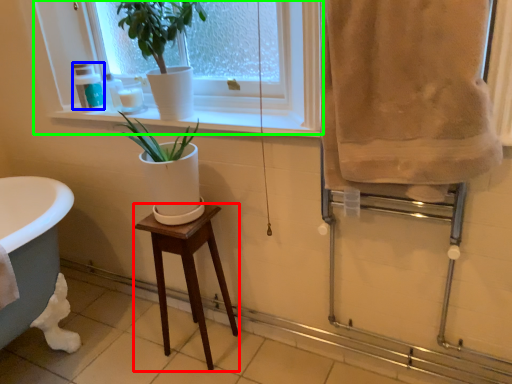
Question: Estimate the real-world distances between objects in this image. Which object is farther from stool (highlighted by a red box), toiletry (highlighted by a blue box) or window (highlighted by a green box)?

Choices:
 (A) toiletry
 (B) window

Answer: (A)